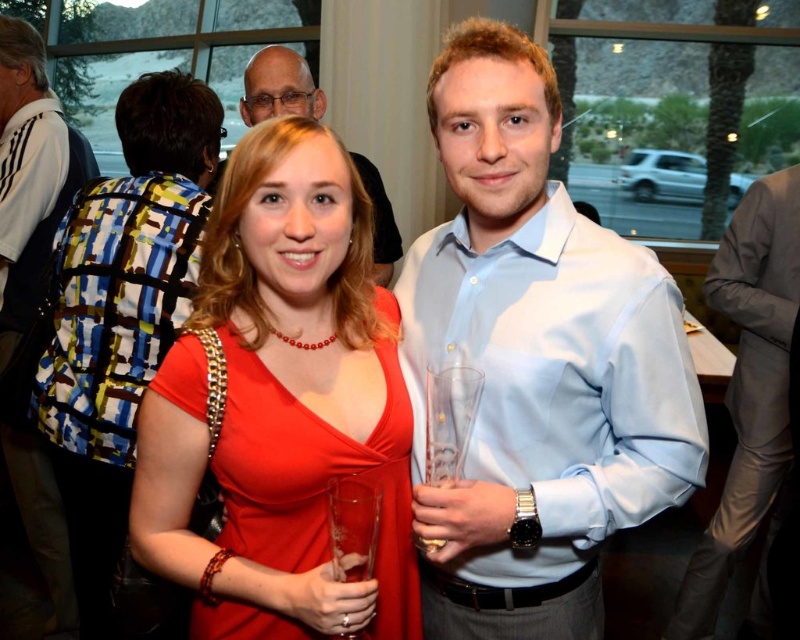
You are a photographer standing at the event. You want to take a closeup shot of the matte red dress at center without moving the subject. Can you adjust your camera zoom to capture the dress clearly from your current position?

The matte red dress at center is 35.05 inches away from the camera. Since this distance is relatively close, adjusting the camera zoom to a moderate telephoto setting should allow you to capture the dress clearly without needing to move closer.